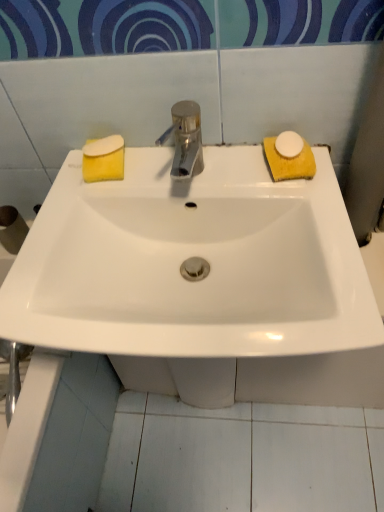
I want to click on free space to the left of polished metallic tap at center, so click(x=110, y=189).